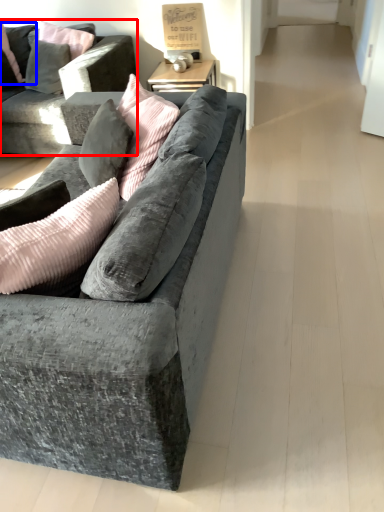
Question: Which object is closer to the camera taking this photo, studio couch (highlighted by a red box) or pillow (highlighted by a blue box)?

Choices:
 (A) studio couch
 (B) pillow

Answer: (A)